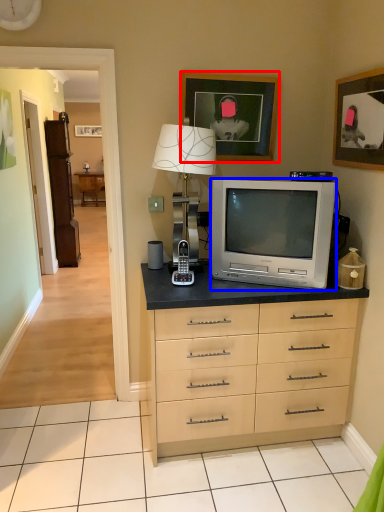
Question: Which object appears closest to the camera in this image, picture frame (highlighted by a red box) or television (highlighted by a blue box)?

Choices:
 (A) picture frame
 (B) television

Answer: (B)